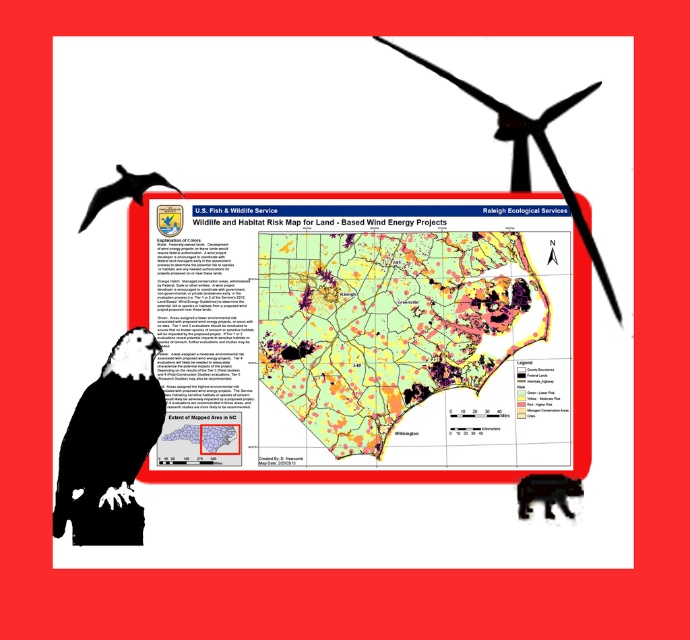
Looking at this image, you are an environmental planner reviewing this map. You notice the black matte wind turbine at upper right and the black fur bear at lower left. Based on their positions, which object is situated higher up in the image?

The black matte wind turbine at upper right is located above the black fur bear at lower left, so it is situated higher up in the image.

You are a wildlife conservationist reviewing the map and notice two symbols at the lower left corner. Which of the two symbols, the black matte eagle at lower left or the black fur bear at lower left, is bigger in size?

The black matte eagle at lower left is larger in size than the black fur bear at lower left.